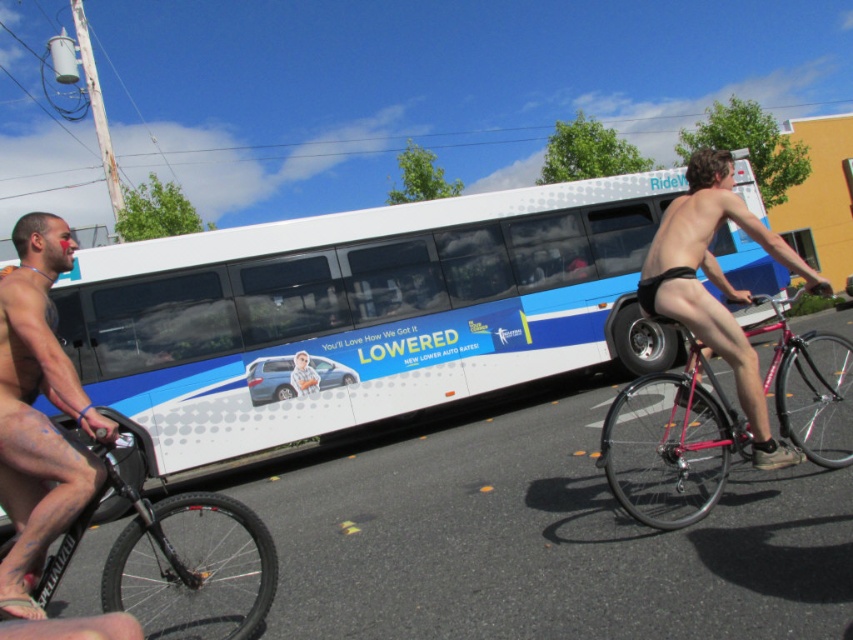
Question: Observing the image, what is the correct spatial positioning of matte black shorts at left in reference to black matte shorts at right?

Choices:
 (A) above
 (B) below

Answer: (B)

Question: Which point is farther to the camera?

Choices:
 (A) (379, 378)
 (B) (90, 420)
 (C) (195, 548)

Answer: (A)

Question: Which object is farther from the camera taking this photo?

Choices:
 (A) shiny red bicycle at center
 (B) black matte bicycle at left

Answer: (A)

Question: Does matte black shorts at left come in front of black matte bicycle at left?

Choices:
 (A) no
 (B) yes

Answer: (B)

Question: Is the position of white matte bus at center more distant than that of matte black shorts at left?

Choices:
 (A) yes
 (B) no

Answer: (A)

Question: Based on their relative distances, which object is nearer to the matte black shorts at left?

Choices:
 (A) white matte bus at center
 (B) black matte bicycle at left
 (C) black matte shorts at right
 (D) shiny red bicycle at center

Answer: (B)